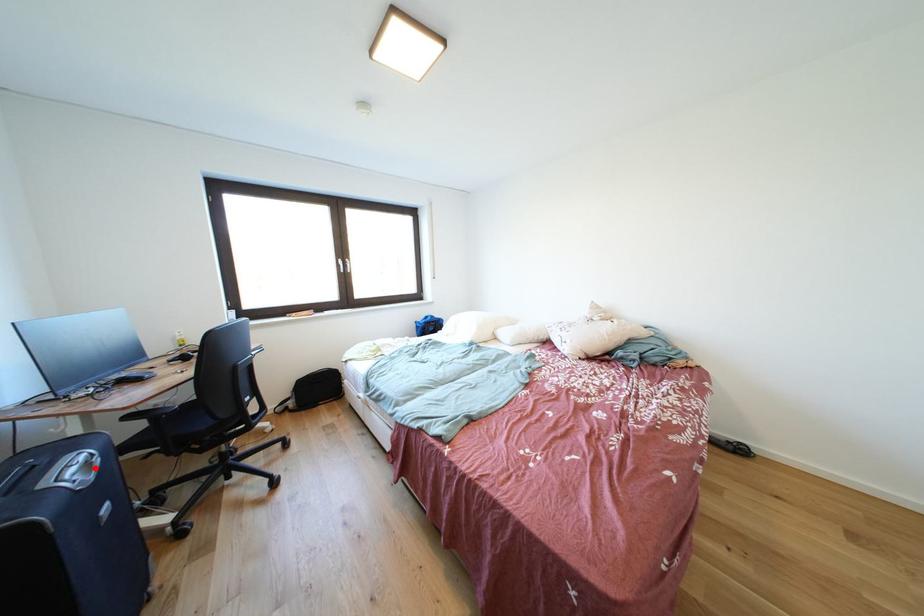
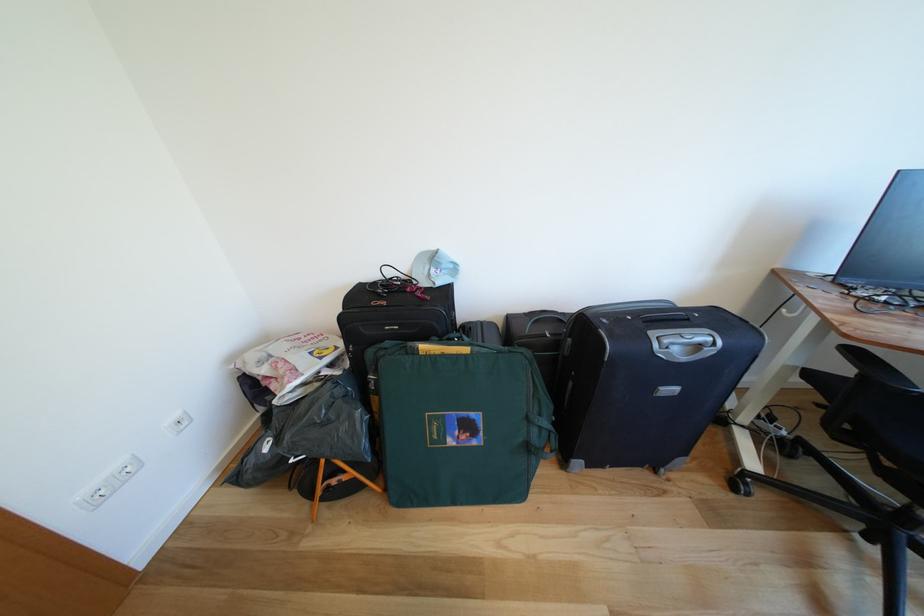
Where in the second image is the point corresponding to the highlighted location from the first image?

(707, 351)